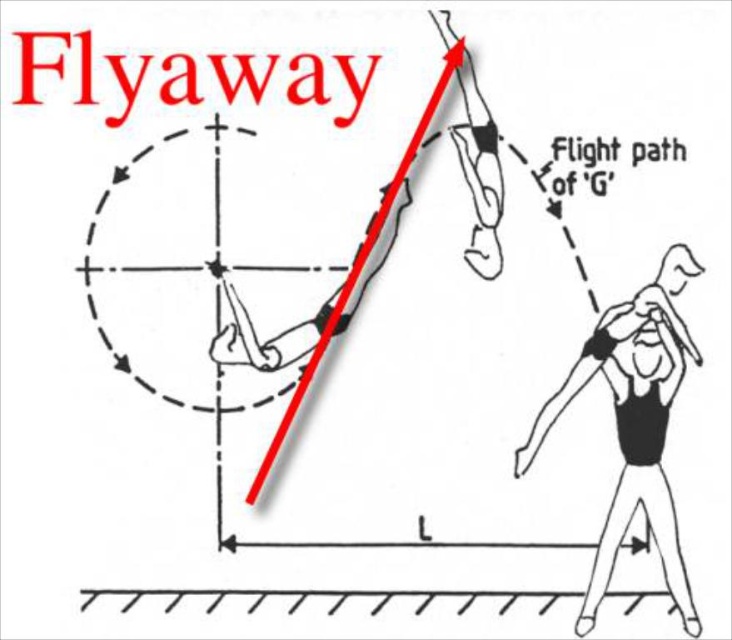
Question: Can you confirm if black matte figure at center is positioned above smooth concrete floor at lower center?

Choices:
 (A) no
 (B) yes

Answer: (B)

Question: Can you confirm if black matte figure at center is positioned above smooth concrete floor at lower center?

Choices:
 (A) no
 (B) yes

Answer: (B)

Question: Which object is closer to the camera taking this photo?

Choices:
 (A) smooth concrete floor at lower center
 (B) black matte figure at center

Answer: (B)

Question: Which point is farther to the camera?

Choices:
 (A) (326, 593)
 (B) (638, 394)

Answer: (A)

Question: Can you confirm if black matte figure at center is thinner than smooth concrete floor at lower center?

Choices:
 (A) yes
 (B) no

Answer: (A)